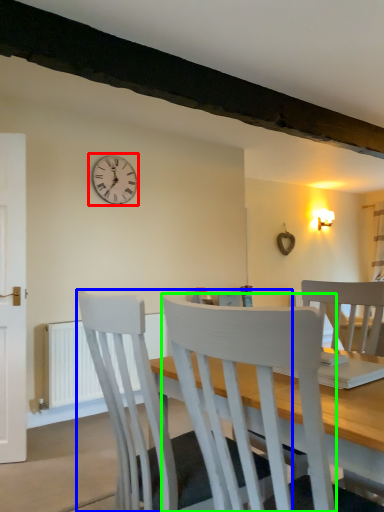
Question: Estimate the real-world distances between objects in this image. Which object is closer to wall clock (highlighted by a red box), chair (highlighted by a blue box) or chair (highlighted by a green box)?

Choices:
 (A) chair
 (B) chair

Answer: (A)